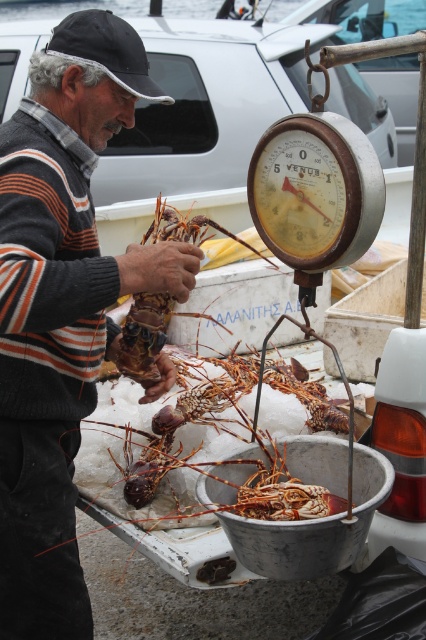
Question: Is striped sweater at center below orange rough lobster at center?

Choices:
 (A) no
 (B) yes

Answer: (A)

Question: Which point is closer to the camera taking this photo?

Choices:
 (A) (43, 384)
 (B) (114, 310)

Answer: (A)

Question: Where is striped sweater at center located in relation to orange rough lobster at center in the image?

Choices:
 (A) below
 (B) above

Answer: (B)

Question: Which object appears closest to the camera in this image?

Choices:
 (A) striped sweater at center
 (B) orange rough lobster at center

Answer: (A)

Question: Is striped sweater at center wider than orange rough lobster at center?

Choices:
 (A) no
 (B) yes

Answer: (B)